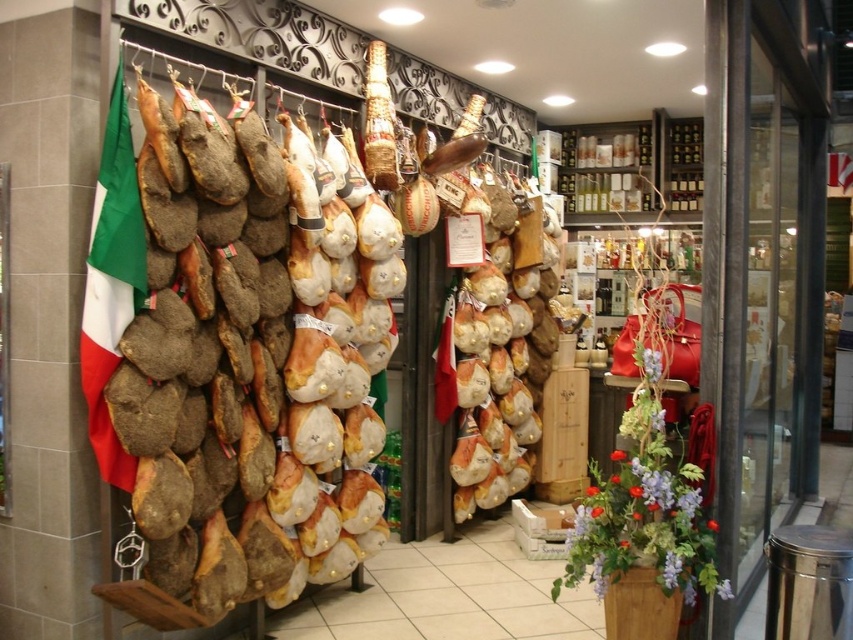
You are a customer in the store and want to pick up the brown leather bag at center. However, there is a brown textured cured meat at left in the way. Can you reach the bag without moving the meat?

The brown textured cured meat at left is closer to the viewer than the brown leather bag at center, so the meat is blocking the path to the bag. You would need to move the meat to access the bag.

You are a customer in the deli and want to locate the brown textured cured meat at left. According to the store layout, where should you look?

The brown textured cured meat at left is located at point (247, 362).

You are a customer in the store and want to place the brown leather bag at center on top of the brown textured cured meat at left. Will the bag fit on top of the meat without hanging over the edges?

The brown textured cured meat at left is shorter than the brown leather bag at center. Since the cured meat is shorter, placing the bag on top would cause it to hang over the edges, so it won